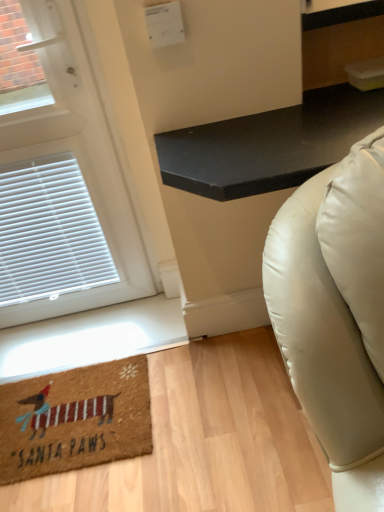
Question: From the image's perspective, is black matte table at upper right located above or below brown coir mat at lower left?

Choices:
 (A) below
 (B) above

Answer: (B)

Question: From their relative heights in the image, would you say black matte table at upper right is taller or shorter than brown coir mat at lower left?

Choices:
 (A) tall
 (B) short

Answer: (A)

Question: Considering the real-world distances, which object is farthest from the black matte table at upper right?

Choices:
 (A) brown coir mat at lower left
 (B) white matte door at upper left

Answer: (A)

Question: Estimate the real-world distances between objects in this image. Which object is farther from the brown coir mat at lower left?

Choices:
 (A) black matte table at upper right
 (B) white matte door at upper left

Answer: (A)